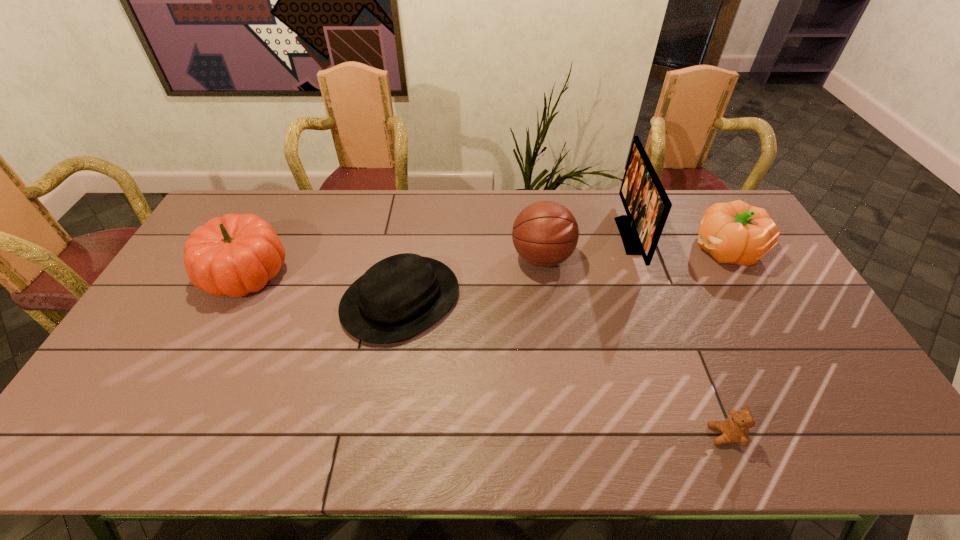
I want to click on monitor, so click(647, 205).

Find the location of a particular element. The height and width of the screenshot is (540, 960). basketball is located at coordinates (545, 233).

You are a GUI agent. You are given a task and a screenshot of the screen. Output one action in this format:
    pyautogui.click(x=<x>, y=<y>)
    Task: Click on the leftmost object
    Image resolution: width=960 pixels, height=540 pixels.
    Given the screenshot: What is the action you would take?
    pyautogui.click(x=237, y=254)

Identify the location of the right pumpkin. (735, 232).

Where is `the second object from left to right`? the second object from left to right is located at coordinates (403, 295).

At what (x,y) coordinates should I click in order to perform the action: click on teddy bear. Please return your answer as a coordinate pair (x, y). Image resolution: width=960 pixels, height=540 pixels. Looking at the image, I should click on pos(735,429).

The height and width of the screenshot is (540, 960). Identify the location of vacant space located 0.400m on the front-facing side of the monitor. (504, 236).

Find the location of a particular element. This screenshot has width=960, height=540. free space located on the front-facing side of the monitor is located at coordinates click(541, 236).

Image resolution: width=960 pixels, height=540 pixels. Identify the location of vacant space located on the front-facing side of the monitor. (544, 236).

This screenshot has width=960, height=540. Identify the location of vacant position located on the back of the basketball. (533, 195).